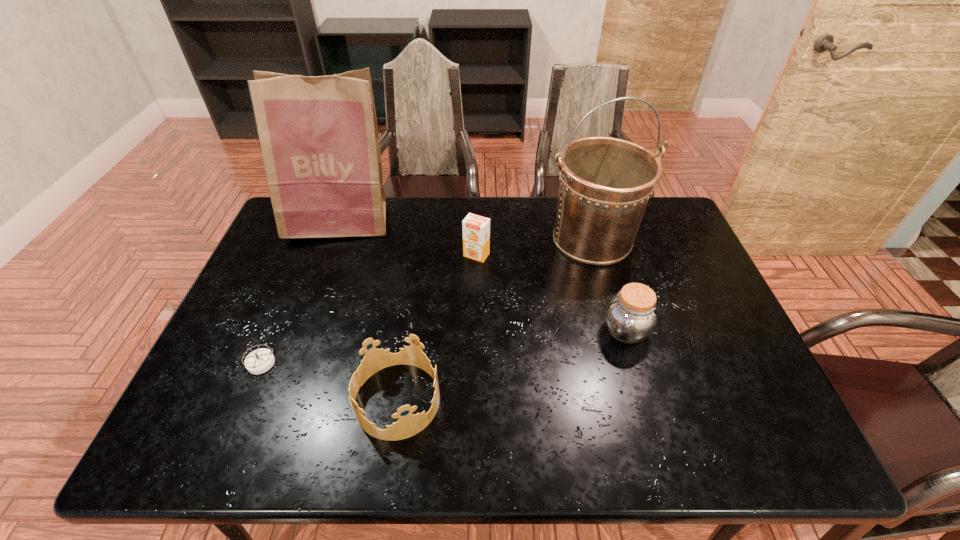
Where is `vacant space at the far edge of the desktop`? vacant space at the far edge of the desktop is located at coordinates (403, 234).

In the image, there is a desktop. Identify the location of vacant space at the near edge. This screenshot has height=540, width=960. (270, 424).

Identify the location of vacant space at the left edge of the desktop. This screenshot has width=960, height=540. (238, 407).

Locate an element on the screen. free space at the right edge is located at coordinates (684, 249).

In the image, there is a desktop. Where is `vacant space at the near right corner`? This screenshot has width=960, height=540. vacant space at the near right corner is located at coordinates (724, 453).

What are the coordinates of `vacant space in between the fourth object from right to left and the shortest object` in the screenshot? It's located at (328, 381).

Locate an element on the screen. free area in between the orange juice and the jar is located at coordinates (551, 293).

What are the coordinates of `free space between the jar and the compass` in the screenshot? It's located at (443, 347).

In order to click on free space that is in between the jar and the third object from left to right in this screenshot , I will do `click(511, 366)`.

Find the location of `free space between the jar and the shortest object`. free space between the jar and the shortest object is located at coordinates (443, 347).